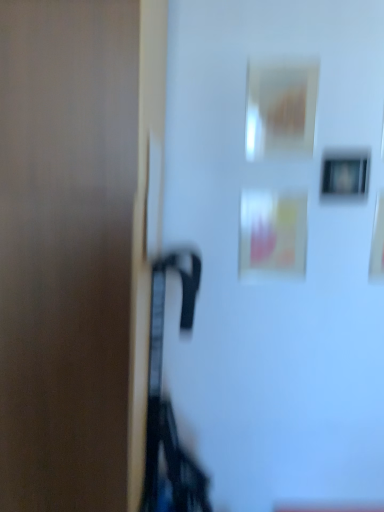
Question: Based on their positions, is matte brown door at left located to the left or right of matte black picture frame at upper right?

Choices:
 (A) right
 (B) left

Answer: (B)

Question: Considering the positions of point (61, 65) and point (354, 159), is point (61, 65) closer or farther from the camera than point (354, 159)?

Choices:
 (A) closer
 (B) farther

Answer: (A)

Question: In terms of width, does matte brown door at left look wider or thinner when compared to matte black picture frame at upper right?

Choices:
 (A) thin
 (B) wide

Answer: (B)

Question: Is point (344, 196) closer or farther from the camera than point (112, 135)?

Choices:
 (A) farther
 (B) closer

Answer: (A)

Question: From a real-world perspective, is matte black picture frame at upper right physically located above or below matte brown door at left?

Choices:
 (A) above
 (B) below

Answer: (A)

Question: Is matte black picture frame at upper right wider or thinner than matte brown door at left?

Choices:
 (A) thin
 (B) wide

Answer: (A)

Question: Is matte black picture frame at upper right spatially inside matte brown door at left, or outside of it?

Choices:
 (A) inside
 (B) outside

Answer: (B)